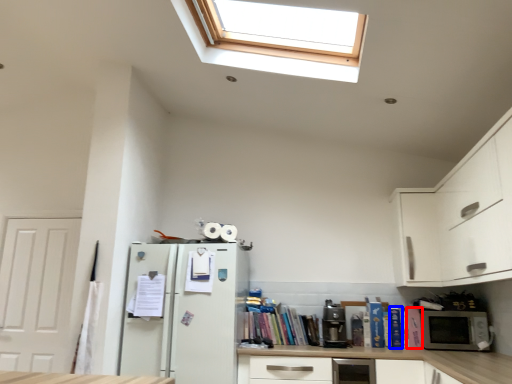
Question: Which of the following is the closest to the observer, book (highlighted by a red box) or book (highlighted by a blue box)?

Choices:
 (A) book
 (B) book

Answer: (A)